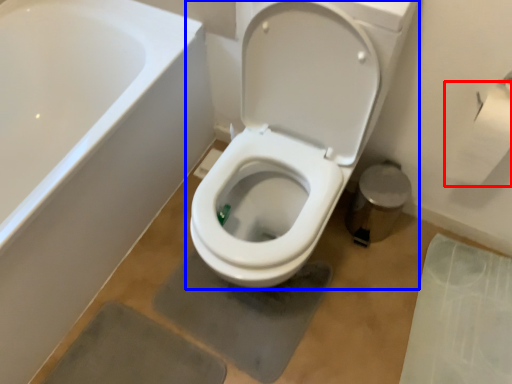
Question: Among these objects, which one is farthest to the camera, toilet paper (highlighted by a red box) or toilet (highlighted by a blue box)?

Choices:
 (A) toilet paper
 (B) toilet

Answer: (A)